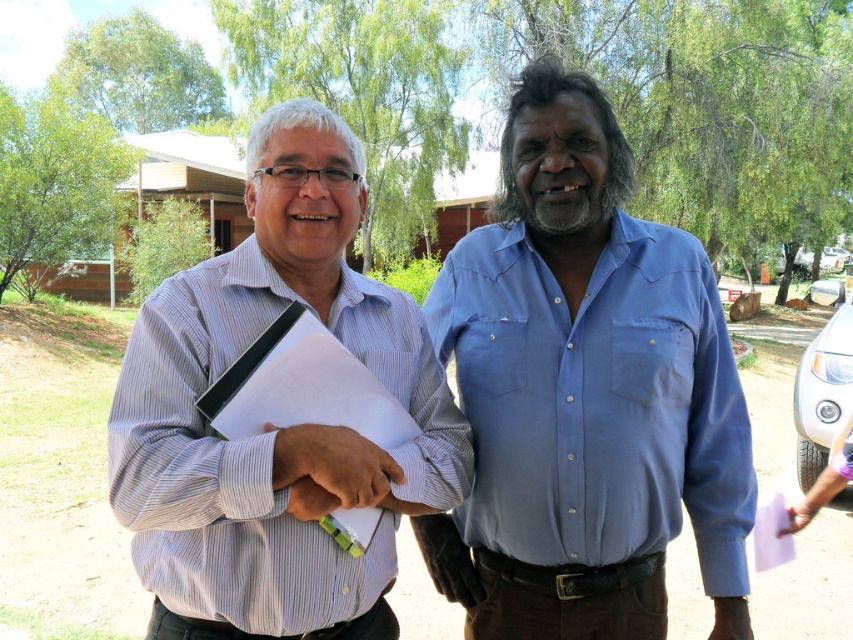
You are a photographer trying to capture a group photo of the white striped shirt at left and the blue cotton shirt at center. Since you want to frame them properly, which person should be placed on the left side of the frame?

The white striped shirt at left should be placed on the left side of the frame because it is already positioned on the left side of the blue cotton shirt at center.